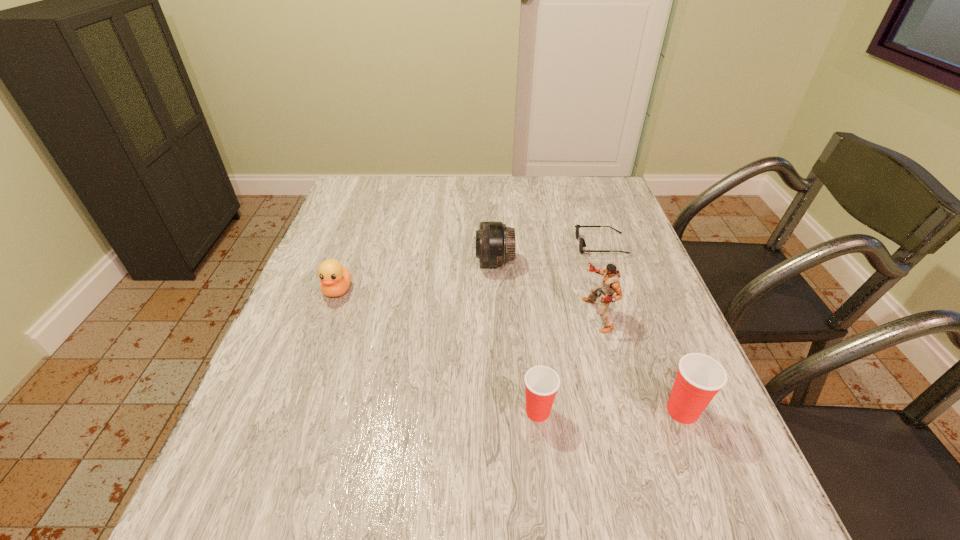
This screenshot has height=540, width=960. In order to click on free space between the left Dixie cup and the tallest object in this screenshot , I will do `click(567, 363)`.

You are a GUI agent. You are given a task and a screenshot of the screen. Output one action in this format:
    pyautogui.click(x=<x>, y=<y>)
    Task: Click on the free spot between the left Dixie cup and the telephoto lens
    Image resolution: width=960 pixels, height=540 pixels.
    Given the screenshot: What is the action you would take?
    pyautogui.click(x=516, y=336)

Image resolution: width=960 pixels, height=540 pixels. I want to click on free point between the left Dixie cup and the leftmost object, so click(438, 351).

Locate an element on the screen. The height and width of the screenshot is (540, 960). unoccupied position between the puncher and the shorter Dixie cup is located at coordinates (567, 363).

Identify the location of free space between the leftmost object and the shorter Dixie cup. This screenshot has height=540, width=960. (438, 351).

In order to click on free spot between the telephoto lens and the shortest object in this screenshot , I will do 548,253.

Locate an element on the screen. vacant region between the left Dixie cup and the puncher is located at coordinates (567, 363).

Locate an element on the screen. This screenshot has width=960, height=540. object that ranks as the closest to the shortest object is located at coordinates (610, 283).

Locate which object is the second closest to the right Dixie cup. Please provide its 2D coordinates. Your answer should be formatted as a tuple, i.e. [(x, y)], where the tuple contains the x and y coordinates of a point satisfying the conditions above.

[(541, 382)]

At what (x,y) coordinates should I click in order to perform the action: click on vacant space that satisfies the following two spatial constraints: 1. on the face of the left Dixie cup; 2. on the left side of the leftmost object. Please return your answer as a coordinate pair (x, y). This screenshot has width=960, height=540. Looking at the image, I should click on (294, 411).